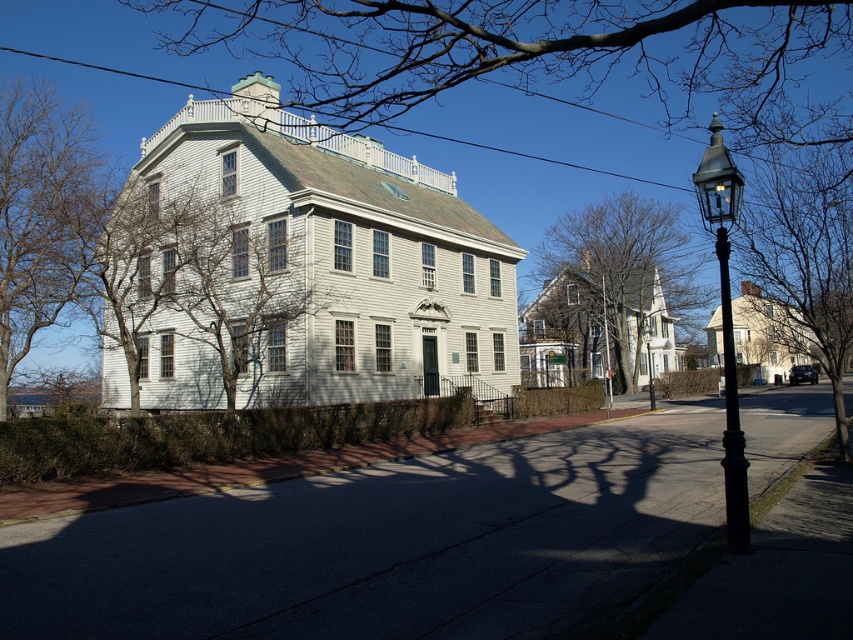
Who is higher up, bare branches at left or black metal streetlight at right?

bare branches at left

Is point (74, 278) farther from viewer compared to point (733, 218)?

Yes, it is.

Identify the location of bare branches at left. Image resolution: width=853 pixels, height=640 pixels. (44, 212).

Does bare branches at upper center appear on the right side of green leafy tree at center?

Indeed, bare branches at upper center is positioned on the right side of green leafy tree at center.

Which of these two, bare branches at upper center or green leafy tree at center, stands shorter?

With less height is green leafy tree at center.

Is point (578, 4) less distant than point (131, 296)?

No, (578, 4) is behind (131, 296).

Locate an element on the screen. The image size is (853, 640). bare branches at upper center is located at coordinates (538, 51).

Is point (119, 330) positioned before point (9, 296)?

That is False.

Does green leafy tree at center have a lesser height compared to bare branches at left?

Indeed, green leafy tree at center has a lesser height compared to bare branches at left.

Who is more forward, (294, 301) or (20, 216)?

Point (294, 301) is in front.

The image size is (853, 640). What are the coordinates of `green leafy tree at center` in the screenshot? It's located at (196, 284).